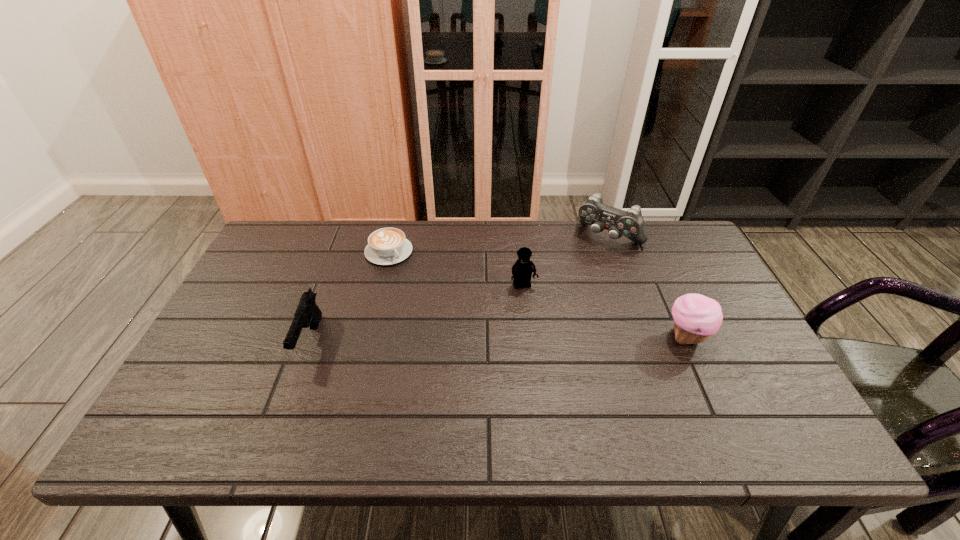
The width and height of the screenshot is (960, 540). I want to click on free area in between the cupcake and the pistol, so click(x=498, y=339).

Locate an element on the screen. free space between the cupcake and the control is located at coordinates (648, 287).

Where is `free space between the control and the shortest object`? The height and width of the screenshot is (540, 960). free space between the control and the shortest object is located at coordinates (499, 245).

At what (x,y) coordinates should I click in order to perform the action: click on unoccupied position between the cappuccino and the third farthest object. Please return your answer as a coordinate pair (x, y). Looking at the image, I should click on (456, 269).

Where is `vacant area between the third object from right to left and the fourth tallest object`? vacant area between the third object from right to left and the fourth tallest object is located at coordinates (417, 313).

Image resolution: width=960 pixels, height=540 pixels. Find the location of `vacant area that lies between the cupcake and the Lego`. vacant area that lies between the cupcake and the Lego is located at coordinates (605, 312).

Where is `vacant area that lies between the pistol and the control`? This screenshot has width=960, height=540. vacant area that lies between the pistol and the control is located at coordinates (459, 288).

Locate an element on the screen. This screenshot has height=540, width=960. free space between the control and the fourth tallest object is located at coordinates (459, 288).

Find the location of a particular element. This screenshot has height=540, width=960. vacant area between the fourth object from right to left and the cupcake is located at coordinates (538, 295).

Image resolution: width=960 pixels, height=540 pixels. Find the location of `object identified as the closest to the cupcake`. object identified as the closest to the cupcake is located at coordinates (630, 224).